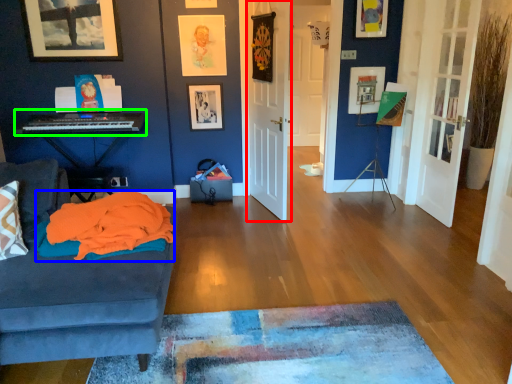
Question: Considering the real-world distances, which object is closest to door (highlighted by a red box)? blanket (highlighted by a blue box) or musical keyboard (highlighted by a green box).

Choices:
 (A) blanket
 (B) musical keyboard

Answer: (B)